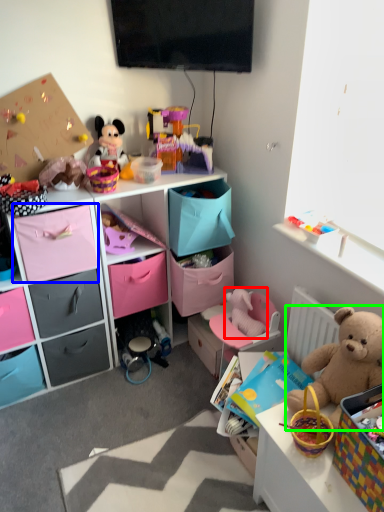
Question: Considering the real-world distances, which object is closest to toy (highlighted by a red box)? drawer (highlighted by a blue box) or teddy bear (highlighted by a green box).

Choices:
 (A) drawer
 (B) teddy bear

Answer: (B)